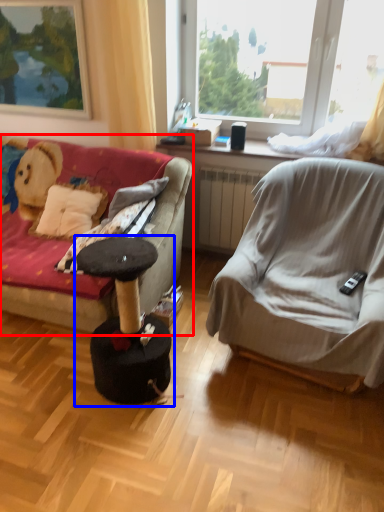
Question: Which object appears closest to the camera in this image, studio couch (highlighted by a red box) or music stool (highlighted by a blue box)?

Choices:
 (A) studio couch
 (B) music stool

Answer: (B)